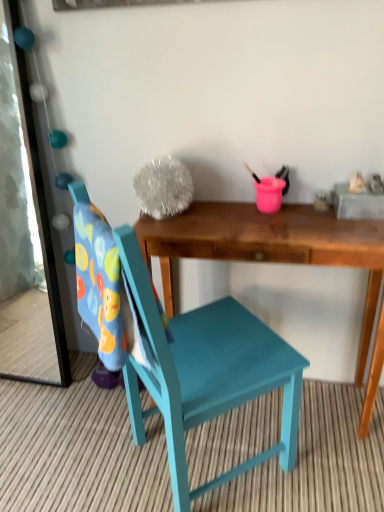
I want to click on free area in between wooden desk at center and teal painted wood chair at center, so click(304, 460).